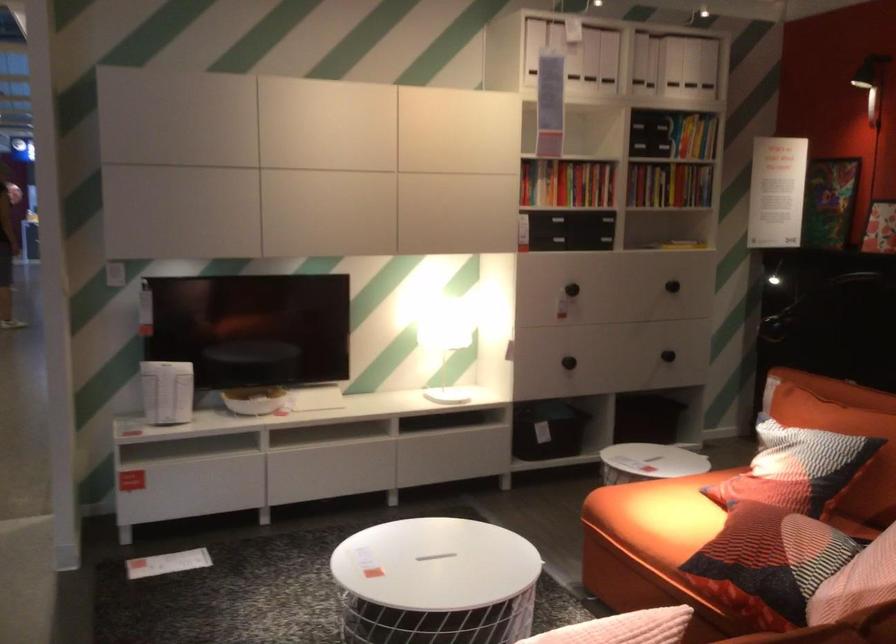
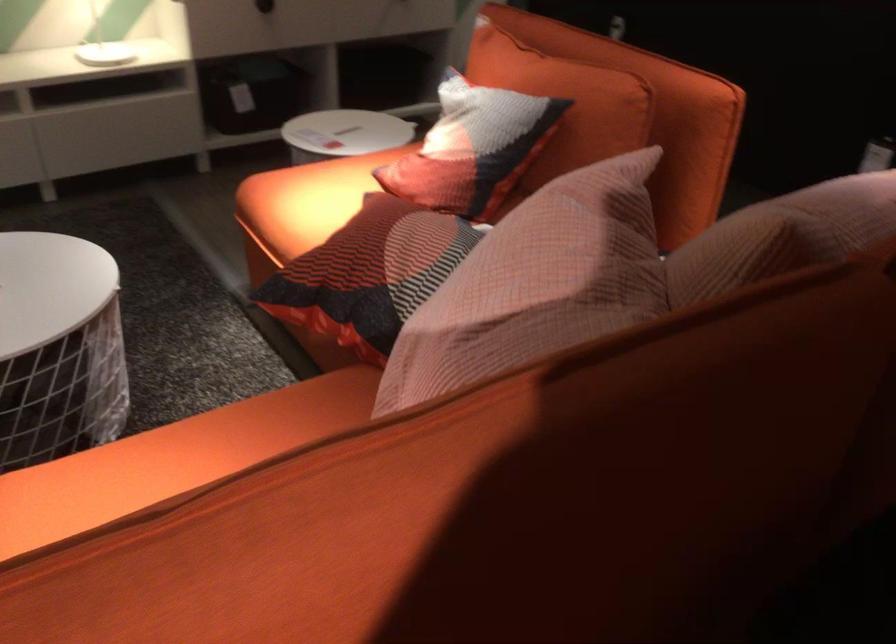
In the second image, find the point that corresponds to [583,360] in the first image.

(264, 6)